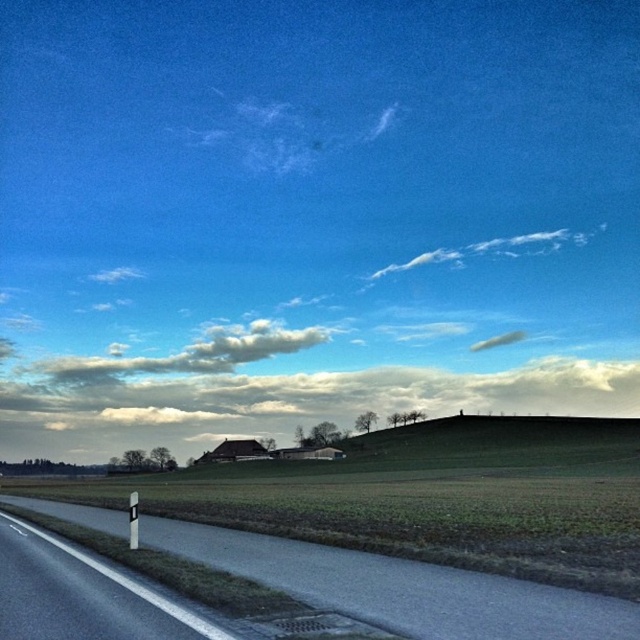
Question: Which of the following is the farthest from the observer?

Choices:
 (A) (221, 332)
 (B) (88, 611)
 (C) (419, 611)

Answer: (A)

Question: Which point is farther from the camera taking this photo?

Choices:
 (A) (476, 588)
 (B) (42, 534)

Answer: (B)

Question: Which of the following is the farthest from the observer?

Choices:
 (A) (301, 348)
 (B) (58, 538)

Answer: (A)

Question: Is asphalt road at lower left to the right of white fluffy cloud at upper center from the viewer's perspective?

Choices:
 (A) yes
 (B) no

Answer: (A)

Question: Is white glossy signpost at lower left above white fluffy cloud at upper center?

Choices:
 (A) yes
 (B) no

Answer: (A)

Question: Does asphalt road at lower left appear over white glossy signpost at lower left?

Choices:
 (A) no
 (B) yes

Answer: (A)